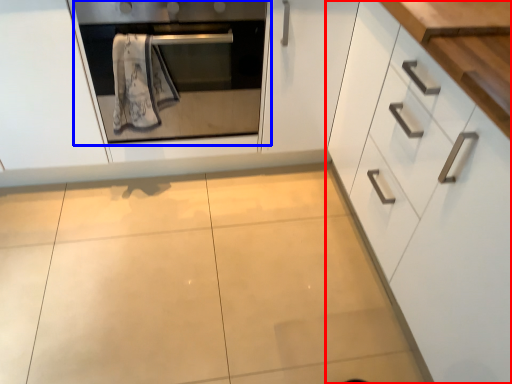
Question: Which object appears closest to the camera in this image, cabinetry (highlighted by a red box) or oven (highlighted by a blue box)?

Choices:
 (A) cabinetry
 (B) oven

Answer: (A)